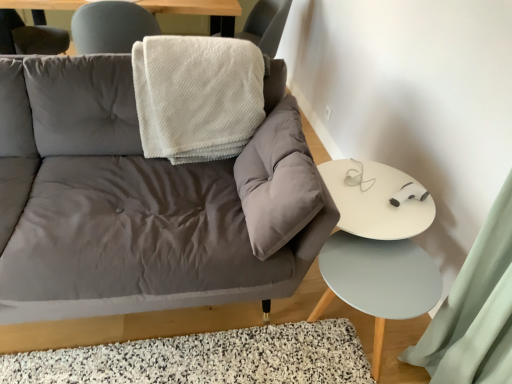
Question: Is white textured blanket at upper center wider than white glossy table at right?

Choices:
 (A) yes
 (B) no

Answer: (A)

Question: Considering the relative sizes of white textured blanket at upper center and white glossy table at right in the image provided, is white textured blanket at upper center shorter than white glossy table at right?

Choices:
 (A) yes
 (B) no

Answer: (B)

Question: From the image's perspective, does white textured blanket at upper center appear higher than white glossy table at right?

Choices:
 (A) no
 (B) yes

Answer: (B)

Question: Is white textured blanket at upper center bigger than white glossy table at right?

Choices:
 (A) no
 (B) yes

Answer: (B)

Question: Considering the relative sizes of white textured blanket at upper center and white glossy table at right in the image provided, is white textured blanket at upper center smaller than white glossy table at right?

Choices:
 (A) no
 (B) yes

Answer: (A)

Question: Is white textured blanket at upper center located outside white glossy table at right?

Choices:
 (A) no
 (B) yes

Answer: (B)

Question: Considering the relative sizes of white glossy table at right and white textured blanket at upper center in the image provided, is white glossy table at right taller than white textured blanket at upper center?

Choices:
 (A) yes
 (B) no

Answer: (B)

Question: Are white glossy table at right and white textured blanket at upper center beside each other?

Choices:
 (A) yes
 (B) no

Answer: (B)

Question: Can you confirm if white glossy table at right is shorter than white textured blanket at upper center?

Choices:
 (A) yes
 (B) no

Answer: (A)

Question: Does white glossy table at right have a larger size compared to white textured blanket at upper center?

Choices:
 (A) yes
 (B) no

Answer: (B)

Question: Is white glossy table at right looking in the opposite direction of white textured blanket at upper center?

Choices:
 (A) no
 (B) yes

Answer: (B)

Question: Does white glossy table at right turn towards white textured blanket at upper center?

Choices:
 (A) no
 (B) yes

Answer: (A)

Question: Is white fluffy blanket at upper center bigger than matte gray couch at center?

Choices:
 (A) yes
 (B) no

Answer: (B)